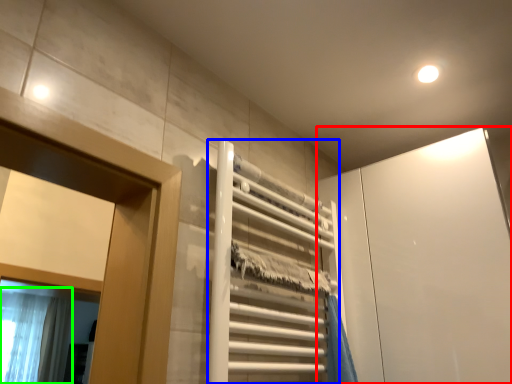
Question: Which object is positioned closest to screen door (highlighted by a red box)? Select from elevator (highlighted by a blue box) and shower curtain (highlighted by a green box).

Choices:
 (A) elevator
 (B) shower curtain

Answer: (A)